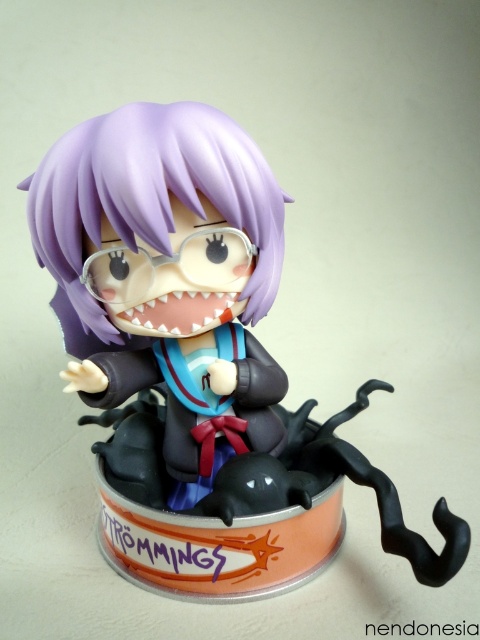
You are an interior designer planning to place the matte purple figure at center on a shelf. The shelf is 1 meter away from where you are standing. If the figure is currently 64.47 centimeters away from the camera, will it fit on the shelf without being too close or too far?

The matte purple figure at center is 64.47 centimeters from the camera. Since the shelf is 1 meter away, which is farther than the figure, placing it there would move it further away from the camera. However, the exact distance on the shelf isn not specified, so it depends on desired placement.

From the picture: You are an art collector examining a new acquisition. You notice the matte purple figure at center and the purple matte hair at center. Which object is located below the other?

The matte purple figure at center is positioned under the purple matte hair at center, meaning the figure is below the hair.